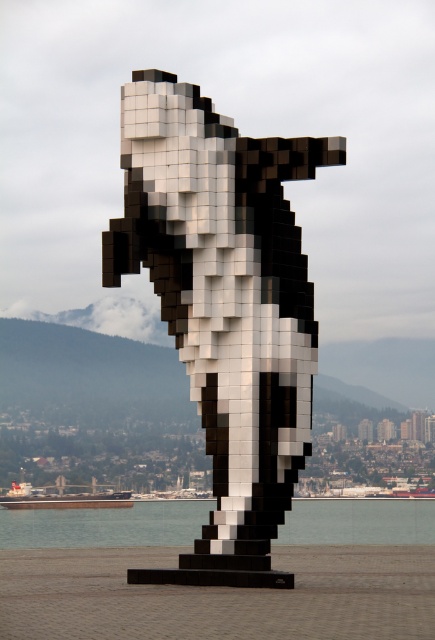
Between black pixelated orca at center and transparent glass water at lower center, which one appears on the right side from the viewer's perspective?

From the viewer's perspective, black pixelated orca at center appears more on the right side.

Where is `black pixelated orca at center`? The image size is (435, 640). black pixelated orca at center is located at coordinates (224, 307).